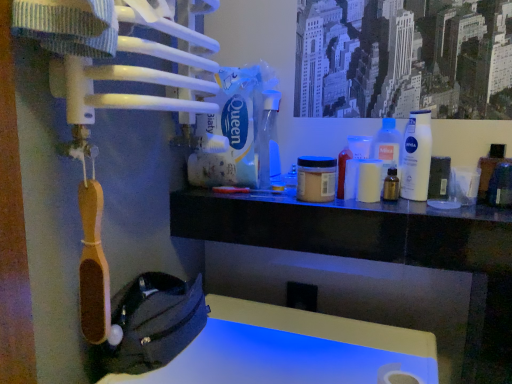
Locate an element on the screen. The image size is (512, 384). vacant region in front of translucent plastic bottle at center right is located at coordinates (417, 206).